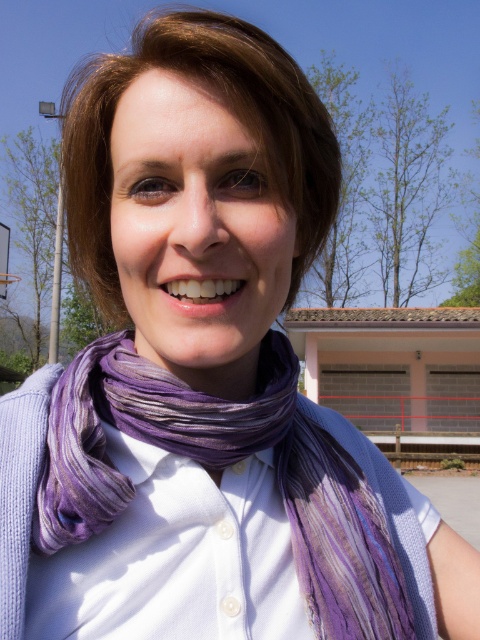
You are a fashion stylist helping someone choose a scarf for a casual day out. The person has two scarves available in their wardrobe, the purple silk scarf at center and the purple striped scarf at center. They want to know which scarf is wider. What would you tell them?

The purple silk scarf at center is wider than the purple striped scarf at center according to the description.